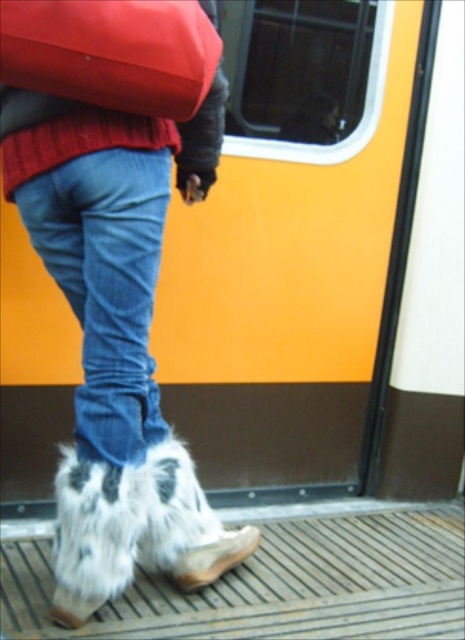
Question: Does blue denim jeans at center have a larger size compared to brown suede boot at lower center?

Choices:
 (A) no
 (B) yes

Answer: (B)

Question: Can you confirm if white furry boots at lower center is positioned to the right of blue denim jeans at center?

Choices:
 (A) no
 (B) yes

Answer: (B)

Question: Which point is farther to the camera?

Choices:
 (A) (207, 572)
 (B) (191, 532)
 (C) (93, 260)
 (D) (10, 26)

Answer: (A)

Question: Among these points, which one is nearest to the camera?

Choices:
 (A) (135, 221)
 (B) (123, 284)
 (C) (211, 544)

Answer: (A)

Question: In this image, where is white furry boots at lower center located relative to matte red backpack at upper left?

Choices:
 (A) below
 (B) above

Answer: (A)

Question: Which of the following is the closest to the observer?

Choices:
 (A) (163, 51)
 (B) (114, 173)
 (C) (232, 534)

Answer: (A)